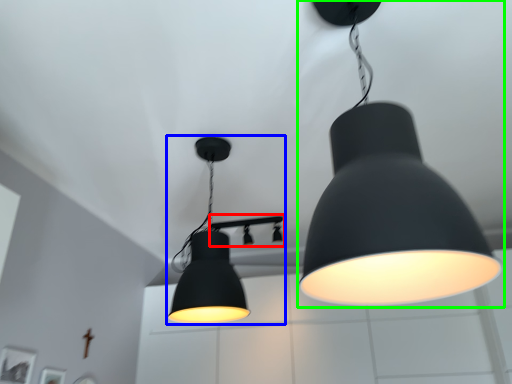
Question: Considering the real-world distances, which object is closest to lamp (highlighted by a red box)? lamp (highlighted by a blue box) or lamp (highlighted by a green box).

Choices:
 (A) lamp
 (B) lamp

Answer: (A)